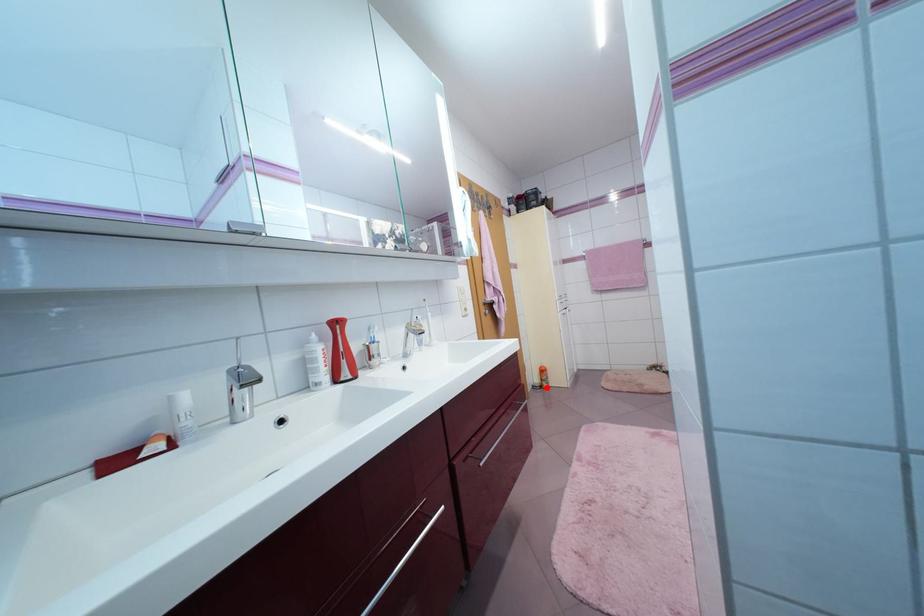
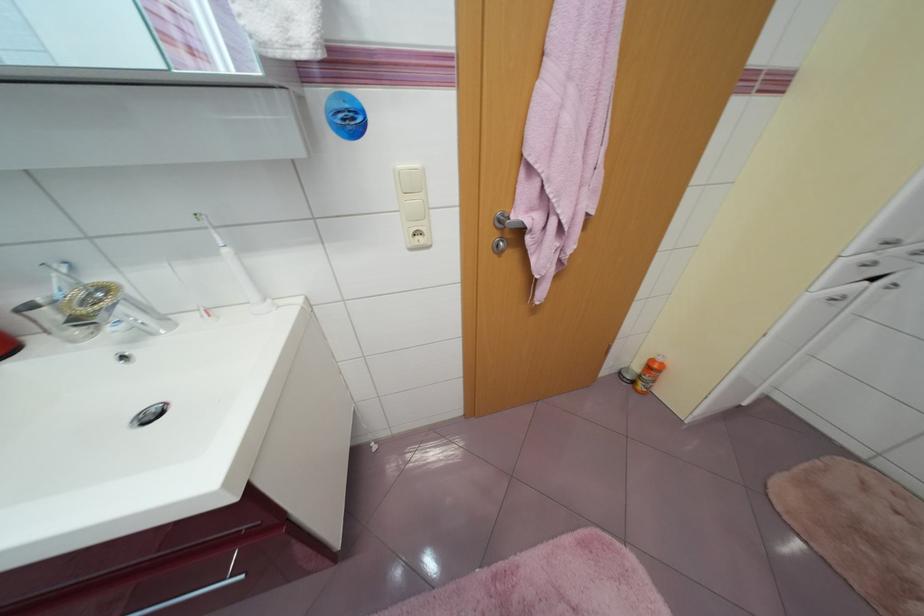
Question: I am providing you with two images of the same scene from different viewpoints. Given a red point in image1, look at the same physical point in image2. Is it:

Choices:
 (A) Closer to the viewpoint
 (B) Farther from the viewpoint

Answer: (A)